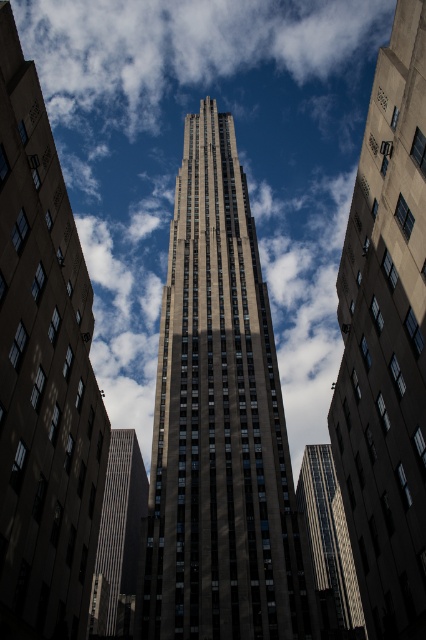
You are standing in the middle of the city and see the white fluffy cloud at center and the dark gray stone tower at center. Which object is positioned to the left?

The white fluffy cloud at center is positioned to the left of the dark gray stone tower at center.